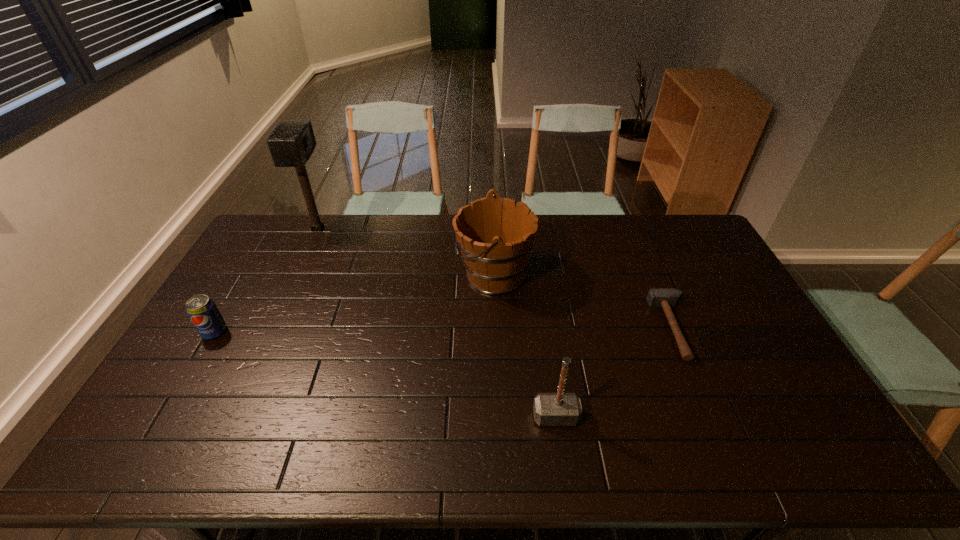
I want to click on the farthest object, so click(292, 142).

What are the coordinates of `mallet` in the screenshot? It's located at (292, 142).

I want to click on wine bucket, so click(495, 235).

You are a GUI agent. You are given a task and a screenshot of the screen. Output one action in this format:
    pyautogui.click(x=<x>, y=<y>)
    Task: Click on the nearer hammer
    Image resolution: width=960 pixels, height=540 pixels.
    Given the screenshot: What is the action you would take?
    pyautogui.click(x=550, y=409)

At what (x,y) coordinates should I click in order to perform the action: click on the nearest object. Please return your answer as a coordinate pair (x, y). Looking at the image, I should click on (550, 409).

Image resolution: width=960 pixels, height=540 pixels. Find the location of `the leftmost object`. the leftmost object is located at coordinates (202, 310).

Locate an element on the screen. The image size is (960, 540). the fourth tallest object is located at coordinates (202, 310).

The height and width of the screenshot is (540, 960). I want to click on the shorter hammer, so click(666, 298).

Locate an element on the screen. the farther hammer is located at coordinates coord(666,298).

Find the location of a particular element. This screenshot has width=960, height=540. vacant space located 0.240m on the right of the tallest object is located at coordinates (393, 229).